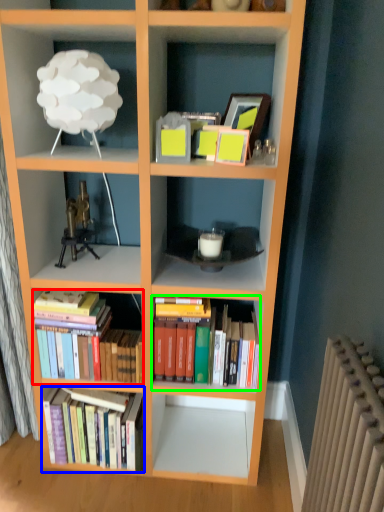
Question: Which is farther away from book (highlighted by a red box)? book (highlighted by a blue box) or book (highlighted by a green box)?

Choices:
 (A) book
 (B) book

Answer: (B)